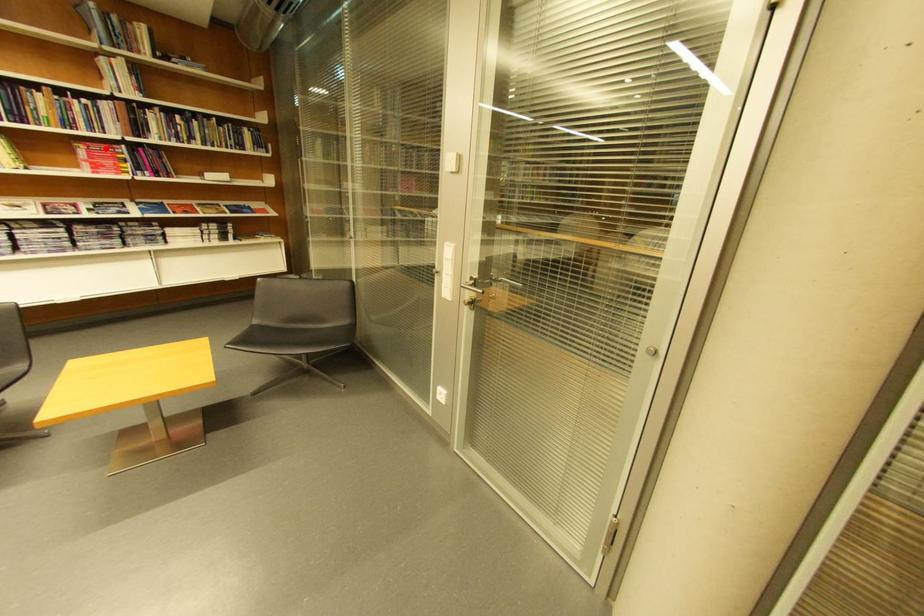
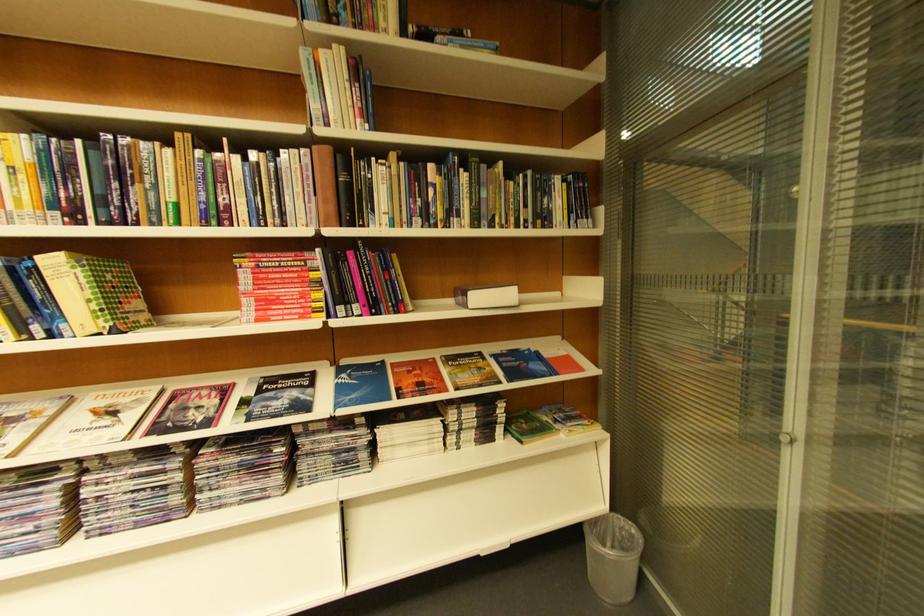
Question: I am providing you with two images of the same scene from different viewpoints. Image1 has a red point marked. In image2, the corresponding 3D location appears at what relative position? Reply with the corresponding letter.

Choices:
 (A) Closer
 (B) Farther

Answer: (A)